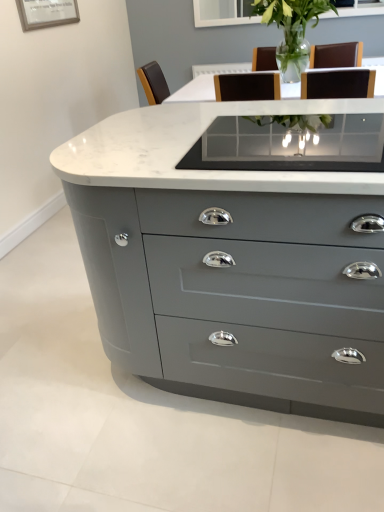
This screenshot has height=512, width=384. What do you see at coordinates (290, 144) in the screenshot?
I see `clear glass table at center` at bounding box center [290, 144].

This screenshot has width=384, height=512. Describe the element at coordinates (230, 265) in the screenshot. I see `matte gray chest of drawers at center` at that location.

The width and height of the screenshot is (384, 512). What are the coordinates of `clear glass table at center` in the screenshot? It's located at (290, 144).

You are a GUI agent. You are given a task and a screenshot of the screen. Output one action in this format:
    pyautogui.click(x=<x>, y=<y>)
    Task: Click on the glass table lying below the clear glass vase at center (from the image's perspective)
    The height and width of the screenshot is (512, 384).
    Given the screenshot: What is the action you would take?
    pyautogui.click(x=290, y=144)

How different are the orientations of clear glass vase at center and clear glass table at center in degrees?

The angle between the facing direction of clear glass vase at center and the facing direction of clear glass table at center is 1.19 degrees.

From a real-world perspective, does clear glass vase at center sit lower than clear glass table at center?

Incorrect, from a real-world perspective, clear glass vase at center is higher than clear glass table at center.

Which is closer, (322, 8) or (286, 117)?

Point (322, 8) is farther from the camera than point (286, 117).

Considering the relative sizes of clear glass table at center and matte gray chest of drawers at center in the image provided, is clear glass table at center smaller than matte gray chest of drawers at center?

Yes, clear glass table at center is smaller than matte gray chest of drawers at center.

How different are the orientations of clear glass table at center and matte gray chest of drawers at center in degrees?

The facing directions of clear glass table at center and matte gray chest of drawers at center are 0.00017 degrees apart.

From the image's perspective, is clear glass table at center positioned above or below matte gray chest of drawers at center?

clear glass table at center is situated higher than matte gray chest of drawers at center in the image.

Is clear glass table at center touching matte gray chest of drawers at center?

clear glass table at center is not next to matte gray chest of drawers at center, and they're not touching.

Considering the relative positions of clear glass table at center and clear glass vase at center in the image provided, is clear glass table at center to the left of clear glass vase at center from the viewer's perspective?

Correct, you'll find clear glass table at center to the left of clear glass vase at center.

The image size is (384, 512). I want to click on plant to the right of clear glass table at center, so click(x=291, y=21).

Is clear glass table at center inside the boundaries of clear glass vase at center, or outside?

The correct answer is: outside.

How distant is clear glass table at center from clear glass vase at center?

clear glass table at center and clear glass vase at center are 5.40 feet apart.

Is matte gray chest of drawers at center in contact with clear glass vase at center?

matte gray chest of drawers at center is not next to clear glass vase at center, and they're not touching.

In order to click on plant above the matte gray chest of drawers at center (from a real-world perspective) in this screenshot , I will do `click(291, 21)`.

Is matte gray chest of drawers at center aimed at clear glass vase at center?

No, matte gray chest of drawers at center is not aimed at clear glass vase at center.

From a real-world perspective, which object rests below the other?

In real-world perspective, matte gray chest of drawers at center is lower.

How many degrees apart are the facing directions of matte gray chest of drawers at center and clear glass table at center?

The facing directions of matte gray chest of drawers at center and clear glass table at center are 0.00017 degrees apart.

Based on their positions, is matte gray chest of drawers at center located to the left or right of clear glass table at center?

In the image, matte gray chest of drawers at center appears on the left side of clear glass table at center.

Is matte gray chest of drawers at center not within clear glass table at center?

Indeed, matte gray chest of drawers at center is completely outside clear glass table at center.

Would you consider matte gray chest of drawers at center to be distant from clear glass table at center?

No, matte gray chest of drawers at center is not far from clear glass table at center.

Is clear glass vase at center inside the boundaries of matte gray chest of drawers at center, or outside?

clear glass vase at center is located beyond the bounds of matte gray chest of drawers at center.

Would you say clear glass vase at center is to the left or to the right of matte gray chest of drawers at center in the picture?

clear glass vase at center is positioned on matte gray chest of drawers at center's right side.

From a real-world perspective, is clear glass vase at center positioned over matte gray chest of drawers at center based on gravity?

Yes.

Is clear glass vase at center positioned before matte gray chest of drawers at center?

No, clear glass vase at center is behind matte gray chest of drawers at center.

Locate an element on the screen. plant above the clear glass table at center (from the image's perspective) is located at coordinates (291, 21).

Where is `chest of drawers on the left side of clear glass table at center`? The height and width of the screenshot is (512, 384). chest of drawers on the left side of clear glass table at center is located at coordinates (230, 265).

Based on their spatial positions, is clear glass table at center or clear glass vase at center closer to matte gray chest of drawers at center?

clear glass table at center is positioned closer to the anchor matte gray chest of drawers at center.

Based on their spatial positions, is matte gray chest of drawers at center or clear glass table at center closer to clear glass vase at center?

clear glass table at center is closer to clear glass vase at center.

From the image, which object appears to be nearer to clear glass table at center, clear glass vase at center or matte gray chest of drawers at center?

The object closer to clear glass table at center is matte gray chest of drawers at center.

Considering their positions, is matte gray chest of drawers at center positioned further to clear glass table at center than clear glass vase at center?

The object further to clear glass table at center is clear glass vase at center.

When comparing their distances from clear glass vase at center, does clear glass table at center or matte gray chest of drawers at center seem closer?

clear glass table at center.

Looking at the image, which one is located further to matte gray chest of drawers at center, clear glass vase at center or clear glass table at center?

clear glass vase at center lies further to matte gray chest of drawers at center than the other object.

Where is `glass table between matte gray chest of drawers at center and clear glass vase at center in the front-back direction`? This screenshot has width=384, height=512. glass table between matte gray chest of drawers at center and clear glass vase at center in the front-back direction is located at coordinates (290, 144).